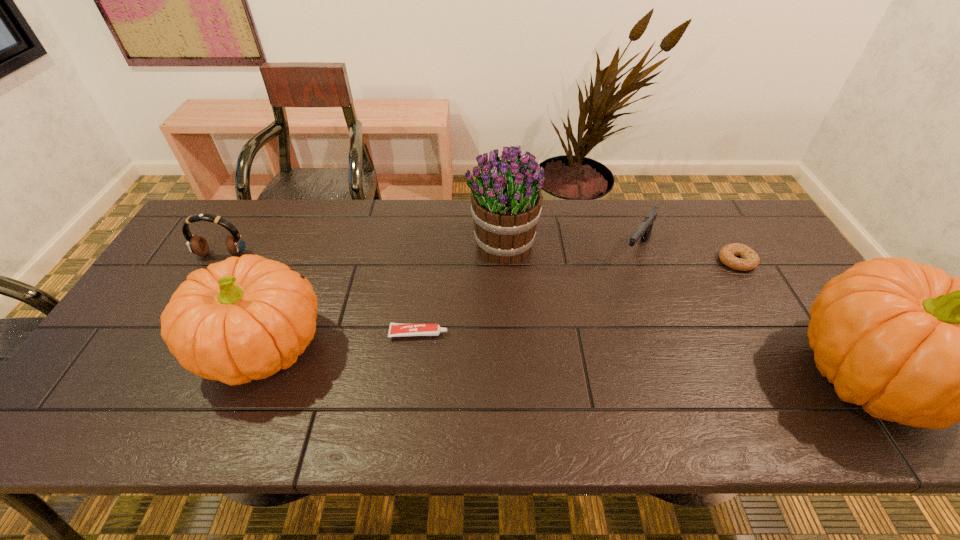
The image size is (960, 540). In order to click on object situated at the right edge in this screenshot , I will do `click(749, 260)`.

The width and height of the screenshot is (960, 540). I want to click on free space at the far edge, so point(374,220).

This screenshot has width=960, height=540. I want to click on free region at the near edge of the desktop, so tap(716, 380).

The height and width of the screenshot is (540, 960). Find the location of `vacant area at the right edge of the desktop`. vacant area at the right edge of the desktop is located at coordinates (749, 272).

You are a GUI agent. You are given a task and a screenshot of the screen. Output one action in this format:
    pyautogui.click(x=<x>, y=<y>)
    Task: Click on the free space at the far left corner of the desktop
    The width and height of the screenshot is (960, 540).
    Given the screenshot: What is the action you would take?
    pyautogui.click(x=209, y=212)

Locate an element on the screen. This screenshot has height=540, width=960. vacant area that lies between the fourth object from left to right and the bagel is located at coordinates (620, 253).

Identify the location of unoccupied area between the shortest object and the bagel. This screenshot has width=960, height=540. (578, 297).

At what (x,y) coordinates should I click in order to perform the action: click on free space between the fourth object from left to right and the third shortest object. Please return your answer as a coordinate pair (x, y). Looking at the image, I should click on (569, 248).

The width and height of the screenshot is (960, 540). Identify the location of vacant area that lies between the fifth object from left to right and the fourth shortest object. (429, 253).

The image size is (960, 540). In order to click on vacant area between the fourth tallest object and the third shortest object in this screenshot , I will do `click(429, 253)`.